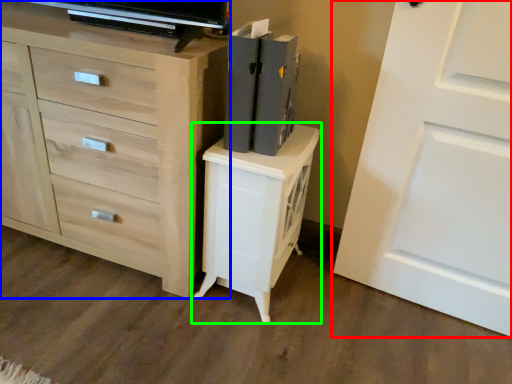
Question: Considering the real-world distances, which object is farthest from door (highlighted by a red box)? chest of drawers (highlighted by a blue box) or nightstand (highlighted by a green box)?

Choices:
 (A) chest of drawers
 (B) nightstand

Answer: (A)